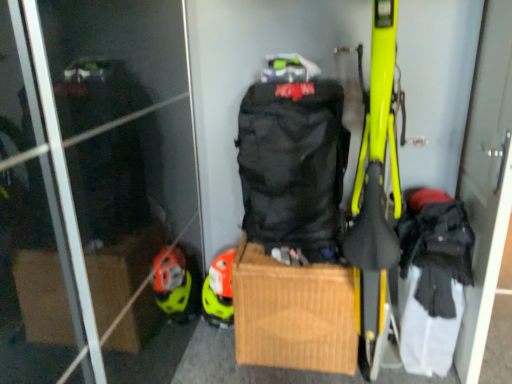
Question: Is brown cardboard box at center wider than orange matte helmet at center?

Choices:
 (A) yes
 (B) no

Answer: (A)

Question: Can you confirm if brown cardboard box at center is bigger than orange matte helmet at center?

Choices:
 (A) yes
 (B) no

Answer: (A)

Question: Is brown cardboard box at center shorter than orange matte helmet at center?

Choices:
 (A) no
 (B) yes

Answer: (A)

Question: Would you say brown cardboard box at center is outside orange matte helmet at center?

Choices:
 (A) yes
 (B) no

Answer: (A)

Question: Can orange matte helmet at center be found inside brown cardboard box at center?

Choices:
 (A) yes
 (B) no

Answer: (B)

Question: Does brown cardboard box at center turn towards orange matte helmet at center?

Choices:
 (A) yes
 (B) no

Answer: (B)

Question: Is black fabric backpack at right in front of orange matte helmet at center?

Choices:
 (A) no
 (B) yes

Answer: (B)

Question: Are black fabric backpack at right and orange matte helmet at center beside each other?

Choices:
 (A) no
 (B) yes

Answer: (A)

Question: Is black fabric backpack at right outside orange matte helmet at center?

Choices:
 (A) yes
 (B) no

Answer: (A)

Question: Does black fabric backpack at right have a lesser height compared to orange matte helmet at center?

Choices:
 (A) no
 (B) yes

Answer: (A)

Question: Does black fabric backpack at right have a smaller size compared to orange matte helmet at center?

Choices:
 (A) no
 (B) yes

Answer: (A)

Question: From a real-world perspective, is black fabric backpack at right on orange matte helmet at center?

Choices:
 (A) no
 (B) yes

Answer: (B)

Question: Does black matte backpack at center have a greater width compared to black fabric backpack at right?

Choices:
 (A) no
 (B) yes

Answer: (B)